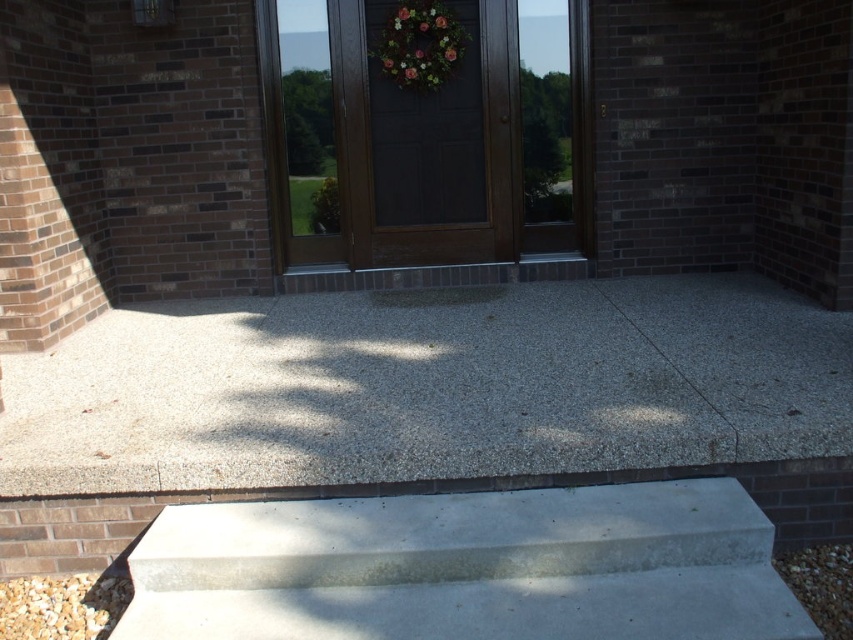
Who is positioned more to the left, brown wooden door at center or green leafy wreath at center?

From the viewer's perspective, green leafy wreath at center appears more on the left side.

Can you confirm if brown wooden door at center is positioned below green leafy wreath at center?

Yes, brown wooden door at center is below green leafy wreath at center.

Find the location of a particular element. brown wooden door at center is located at coordinates (427, 136).

Is brown wooden door at center to the left of dark wood door at center from the viewer's perspective?

Incorrect, brown wooden door at center is not on the left side of dark wood door at center.

Where is `brown wooden door at center`? This screenshot has width=853, height=640. brown wooden door at center is located at coordinates (427, 136).

Locate an element on the screen. The height and width of the screenshot is (640, 853). brown wooden door at center is located at coordinates (427, 136).

Who is more distant from viewer, (494, 77) or (450, 36)?

The point (494, 77) is more distant.

Where is `dark wood door at center`? This screenshot has height=640, width=853. dark wood door at center is located at coordinates (425, 145).

The height and width of the screenshot is (640, 853). Identify the location of dark wood door at center. (425, 145).